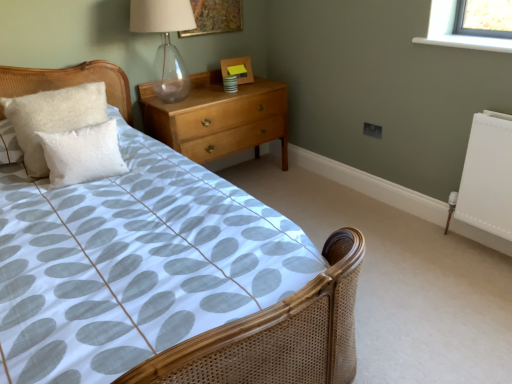
Question: Would you say gold textured picture frame at upper center, positioned as the second picture frame in bottom-to-top order, is part of wooden picture frame at upper center, acting as the 1th picture frame starting from the bottom,'s contents?

Choices:
 (A) no
 (B) yes

Answer: (A)

Question: Are wooden picture frame at upper center, the 2th picture frame viewed from the top, and gold textured picture frame at upper center, acting as the first picture frame starting from the top, making contact?

Choices:
 (A) yes
 (B) no

Answer: (B)

Question: Can you confirm if wooden picture frame at upper center, the 2th picture frame viewed from the top, is smaller than gold textured picture frame at upper center, positioned as the second picture frame in bottom-to-top order?

Choices:
 (A) yes
 (B) no

Answer: (A)

Question: Could you tell me if wooden picture frame at upper center, acting as the 1th picture frame starting from the bottom, is facing gold textured picture frame at upper center, acting as the first picture frame starting from the top?

Choices:
 (A) yes
 (B) no

Answer: (B)

Question: From the image's perspective, is wooden picture frame at upper center, acting as the 1th picture frame starting from the bottom, located beneath gold textured picture frame at upper center, acting as the first picture frame starting from the top?

Choices:
 (A) no
 (B) yes

Answer: (B)

Question: From the image's perspective, is wooden picture frame at upper center, acting as the 1th picture frame starting from the bottom, above gold textured picture frame at upper center, acting as the first picture frame starting from the top?

Choices:
 (A) yes
 (B) no

Answer: (B)

Question: Is transparent glass table lamp at upper center shorter than woven cane bed at center?

Choices:
 (A) no
 (B) yes

Answer: (B)

Question: Is transparent glass table lamp at upper center directly adjacent to woven cane bed at center?

Choices:
 (A) no
 (B) yes

Answer: (A)

Question: Considering the relative sizes of transparent glass table lamp at upper center and woven cane bed at center in the image provided, is transparent glass table lamp at upper center bigger than woven cane bed at center?

Choices:
 (A) no
 (B) yes

Answer: (A)

Question: Is transparent glass table lamp at upper center turned away from woven cane bed at center?

Choices:
 (A) no
 (B) yes

Answer: (A)

Question: Is transparent glass table lamp at upper center to the left of woven cane bed at center from the viewer's perspective?

Choices:
 (A) yes
 (B) no

Answer: (B)

Question: Is the depth of transparent glass table lamp at upper center greater than that of woven cane bed at center?

Choices:
 (A) yes
 (B) no

Answer: (A)

Question: Is wooden picture frame at upper center, the 2th picture frame viewed from the top, at the right side of white fluffy pillow at left, the 2th pillow in the back-to-front sequence?

Choices:
 (A) no
 (B) yes

Answer: (B)